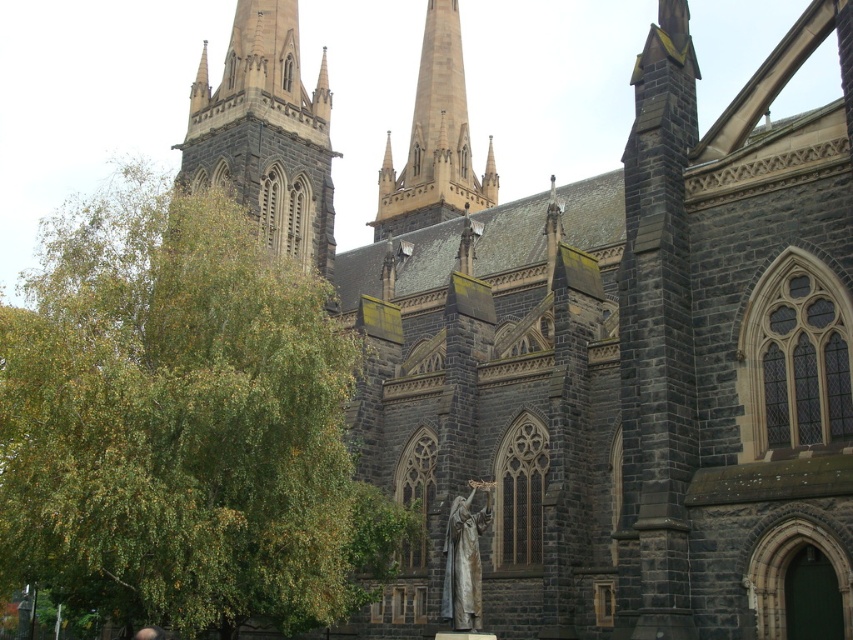
You are standing in front of the grand Gothic church and want to take a photo of the dark gray stone tower at upper left. Considering the distance, will you need a zoom lens to capture the entire tower in your shot?

The dark gray stone tower at upper left is 96.04 meters away from the viewer. A zoom lens would be necessary to capture the entire tower at that distance.

You are standing at the base of the grand Gothic church and want to take a photo of the statue located at point (254, 172). If your camera can focus on objects up to 100 meters away, will you be able to capture the statue clearly?

The distance between point (254, 172) and the viewer is 98.83 meters, which is within the camera focus range of 100 meters. Therefore, you can capture the statue clearly.